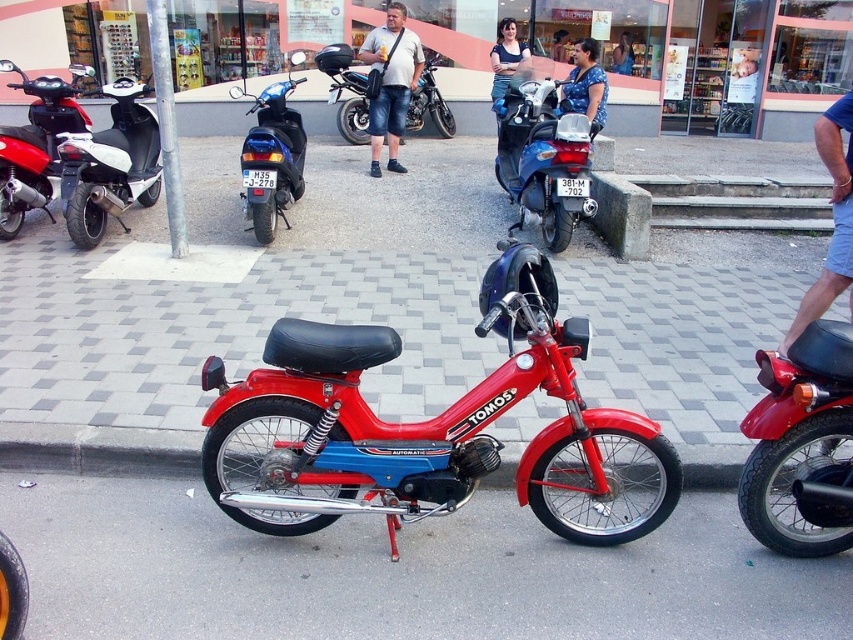
Is shiny red tomos at center wider than matte red moped at left?

Yes.

Can you confirm if shiny red tomos at center is positioned to the right of matte red moped at left?

Result: Yes, shiny red tomos at center is to the right of matte red moped at left.

Is point (283, 412) in front of point (68, 129)?

Yes.

Where is `shiny red tomos at center`? The image size is (853, 640). shiny red tomos at center is located at coordinates (425, 420).

Is smooth asphalt road at center to the left of blue denim dress at center from the viewer's perspective?

Yes, smooth asphalt road at center is to the left of blue denim dress at center.

Is point (758, 561) positioned after point (550, 52)?

No, (758, 561) is in front of (550, 52).

Where is `smooth asphalt road at center`? Image resolution: width=853 pixels, height=640 pixels. smooth asphalt road at center is located at coordinates (397, 573).

Between blue glossy scooter at center and blue dotted dress at center, which one appears on the right side from the viewer's perspective?

Positioned to the right is blue dotted dress at center.

Who is more forward, (286, 147) or (573, 80)?

Point (286, 147)

Between point (277, 193) and point (566, 108), which one is positioned in front?

Point (277, 193)

Where is `blue glossy scooter at center`? blue glossy scooter at center is located at coordinates (271, 157).